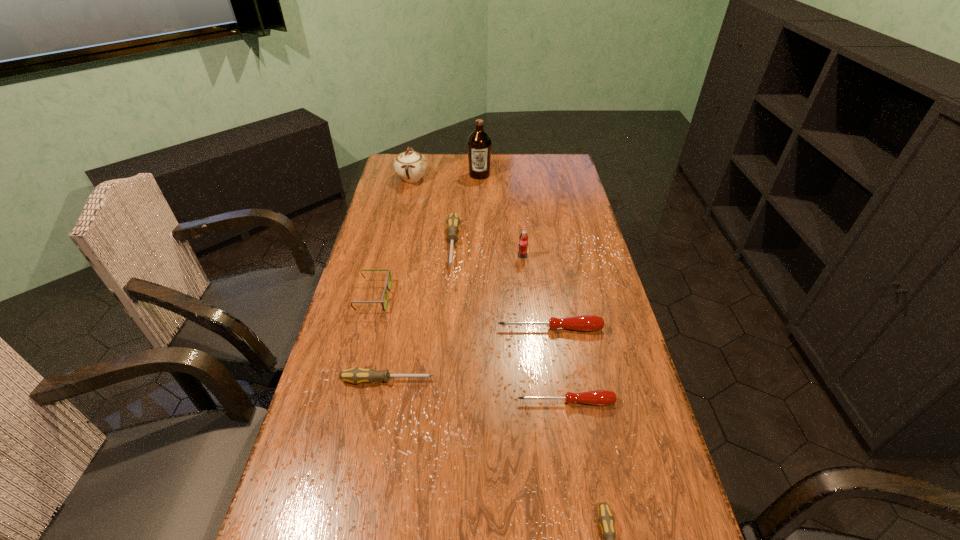
I want to click on free space located 0.160m at the tip of the third nearest object, so click(x=497, y=381).

Where is `vacant region located on the front of the fourth farthest screwdriver`? This screenshot has height=540, width=960. vacant region located on the front of the fourth farthest screwdriver is located at coordinates (584, 509).

The image size is (960, 540). Identify the location of olive oil at the far edge. 479,143.

This screenshot has height=540, width=960. What are the coordinates of `chinaware at the far edge` in the screenshot? It's located at (410, 166).

You are a GUI agent. You are given a task and a screenshot of the screen. Output one action in this format:
    pyautogui.click(x=<x>, y=<y>)
    Task: Click on the chinaware at the left edge
    
    Given the screenshot: What is the action you would take?
    pyautogui.click(x=410, y=166)

The image size is (960, 540). What are the coordinates of `spectacles present at the left edge` in the screenshot? It's located at (389, 273).

Locate an element on the screen. The image size is (960, 540). screwdriver that is at the left edge is located at coordinates (x=357, y=375).

You are a GUI agent. You are given a task and a screenshot of the screen. Output one action in this format:
    pyautogui.click(x=<x>, y=<y>)
    Task: Click on the object that is at the far left corner
    Image resolution: width=960 pixels, height=540 pixels.
    Given the screenshot: What is the action you would take?
    pyautogui.click(x=410, y=166)

Where is `blank space at the far edge`? This screenshot has height=540, width=960. blank space at the far edge is located at coordinates (459, 166).

The image size is (960, 540). Find the location of `blank space at the right edge of the desktop`. blank space at the right edge of the desktop is located at coordinates (581, 403).